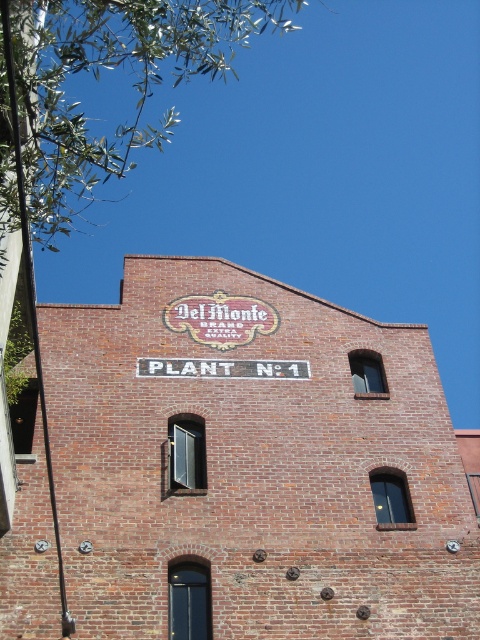
Please look at the image of the brick building. There is a point at coordinates (97, 77). What object is located at this point?

The green leafy branches at upper left are located at point (97, 77).

You are a delivery driver who needs to park your truck in front of the building. The truck has a height of 4 meters. The green leafy branches at upper left and the black painted sign at center are both above the entrance. Which object is closer to the truck if you want to avoid hitting it?

The green leafy branches at upper left are larger than the black painted sign at center, so they are closer to the truck and would be the first to hit if the truck is too tall.